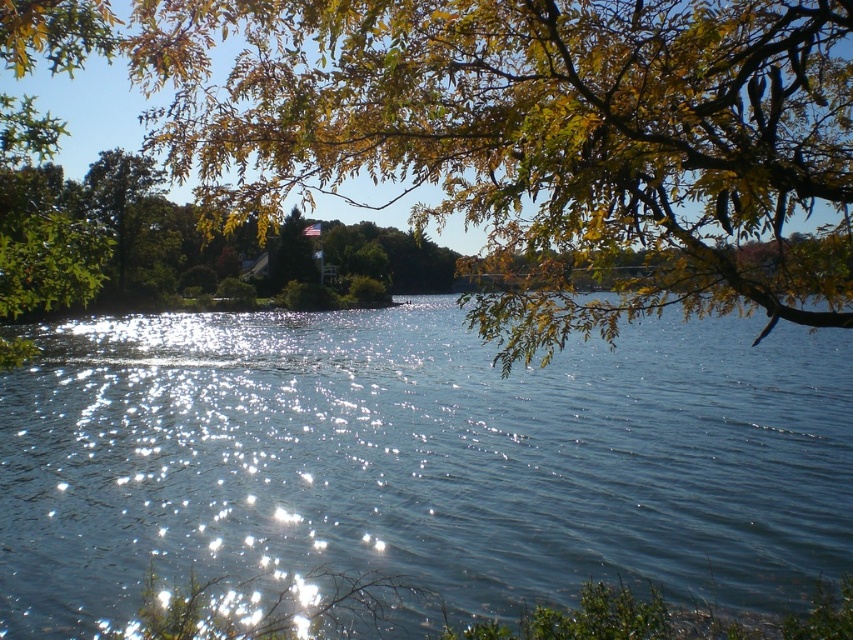
You are an artist planning to paint this lakeside scene. You want to ensure the blue water at center and green leafy branches at upper center are proportionally accurate. Which object should you paint first to maintain the correct size relationship?

You should paint the green leafy branches at upper center first because the blue water at center is larger in size, allowing you to establish the smaller branches as a reference point before painting the larger water area.

You are standing at the lakeside and want to take a photo of the blue water at center and the green leafy branches at upper center. Which object should you point your camera towards first to capture both in the same frame?

You should point your camera towards the green leafy branches at upper center first because the blue water at center is located below them, ensuring both will be in the frame when centered on the branches.